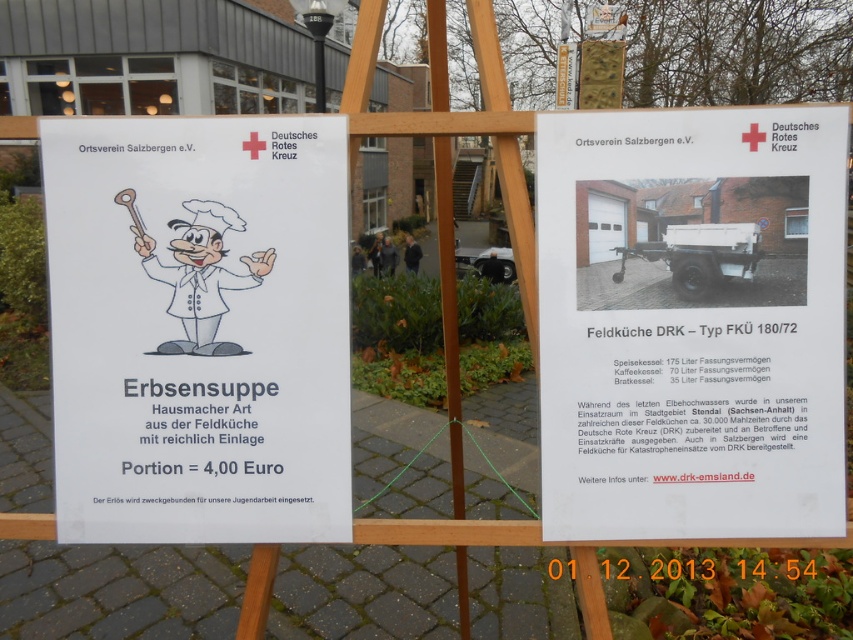
You are organizing an outdoor event and need to display two items on an easel. You have a white paper poster at center and a white paper at center. Which one should you place higher up to make sure the larger one is more visible to attendees?

The white paper poster at center is larger than the white paper at center, so placing the white paper poster at center higher up will make it more visible to attendees.

You are organizing an outdoor event and have two items to display on a narrow table. You have a white paper poster at center and a white paper at center. Which one should you choose to fit better on the table if the table can only accommodate the narrower item?

The white paper at center is narrower than the white paper poster at center, so you should choose the white paper at center to fit better on the narrow table.

You are at an outdoor event and see two items displayed on a wooden easel. They are the white paper poster at center and the white paper at center. Which one is located to the left?

The white paper poster at center is positioned on the left side of white paper at center.